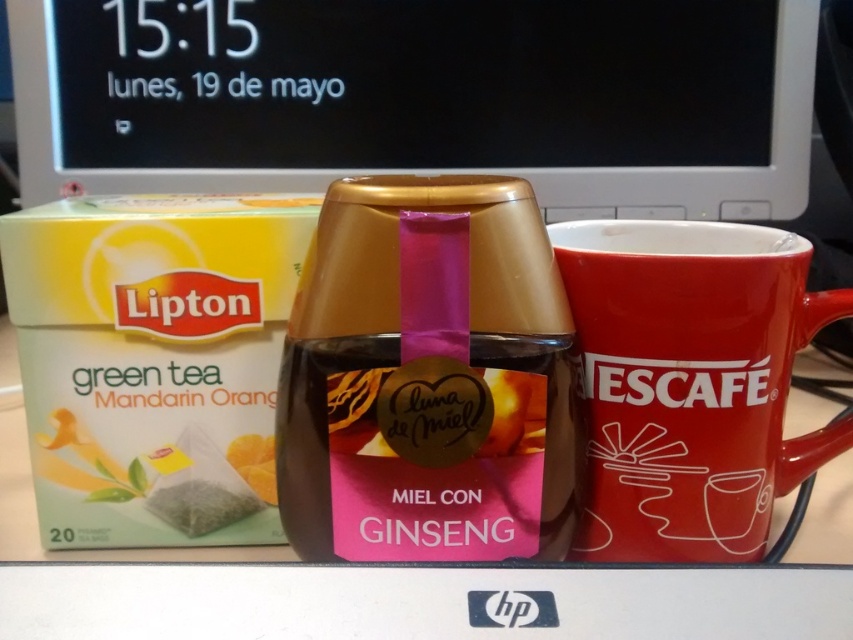
You have a matte plastic laptop at upper center and a red ceramic mug at center on your desk. Which object has a greater width?

The matte plastic laptop at upper center has a greater width than the red ceramic mug at center.

You are organizing items on a desk and need to place a pink glossy jar at center and a red ceramic mug at center. According to the scene, which item is located to the left of the other?

The pink glossy jar at center is positioned on the left side of red ceramic mug at center.

You are organizing items on a desk and need to place a pink glossy jar at center. According to the image, where exactly should you position it?

The pink glossy jar at center should be positioned at point (427, 378).